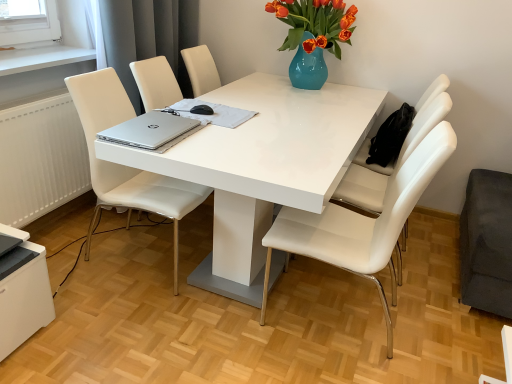
Find the location of a particular element. The width and height of the screenshot is (512, 384). vacant space to the right of silver metallic laptop at center is located at coordinates (278, 119).